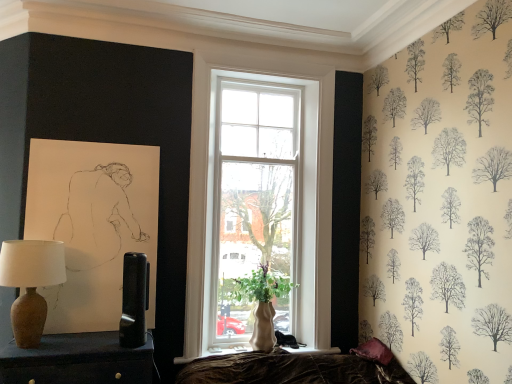
Question: Which direction should I rotate to look at matte black table lamp at center, the second table lamp from the left, — up or down?

Choices:
 (A) up
 (B) down

Answer: (B)

Question: From the image's perspective, is velvet purple pillow at lower right below green matte vase at window?

Choices:
 (A) yes
 (B) no

Answer: (A)

Question: Is velvet purple pillow at lower right thinner than green matte vase at window?

Choices:
 (A) yes
 (B) no

Answer: (A)

Question: Considering the relative sizes of velvet purple pillow at lower right and green matte vase at window in the image provided, is velvet purple pillow at lower right bigger than green matte vase at window?

Choices:
 (A) yes
 (B) no

Answer: (B)

Question: Is velvet purple pillow at lower right positioned beyond the bounds of green matte vase at window?

Choices:
 (A) no
 (B) yes

Answer: (B)

Question: Considering the relative sizes of velvet purple pillow at lower right and green matte vase at window in the image provided, is velvet purple pillow at lower right shorter than green matte vase at window?

Choices:
 (A) yes
 (B) no

Answer: (A)

Question: From the image's perspective, is velvet purple pillow at lower right over green matte vase at window?

Choices:
 (A) no
 (B) yes

Answer: (A)

Question: Is matte brown vase at left, placed as the second table lamp when sorted from right to left, oriented away from matte brown lamp at left?

Choices:
 (A) yes
 (B) no

Answer: (B)

Question: Is the depth of matte brown vase at left, arranged as the first table lamp when viewed from the left, greater than that of matte brown lamp at left?

Choices:
 (A) yes
 (B) no

Answer: (A)

Question: Would you say matte brown vase at left, placed as the second table lamp when sorted from right to left, contains matte brown lamp at left?

Choices:
 (A) yes
 (B) no

Answer: (B)

Question: Is matte brown vase at left, placed as the second table lamp when sorted from right to left, not within matte brown lamp at left?

Choices:
 (A) no
 (B) yes

Answer: (B)

Question: Considering the relative sizes of matte brown vase at left, placed as the second table lamp when sorted from right to left, and matte brown lamp at left in the image provided, is matte brown vase at left, placed as the second table lamp when sorted from right to left, thinner than matte brown lamp at left?

Choices:
 (A) no
 (B) yes

Answer: (B)

Question: From a real-world perspective, is matte brown vase at left, arranged as the first table lamp when viewed from the left, located beneath matte brown lamp at left?

Choices:
 (A) no
 (B) yes

Answer: (A)

Question: Considering the relative sizes of green matte vase at window and matte brown lamp at left in the image provided, is green matte vase at window wider than matte brown lamp at left?

Choices:
 (A) no
 (B) yes

Answer: (A)